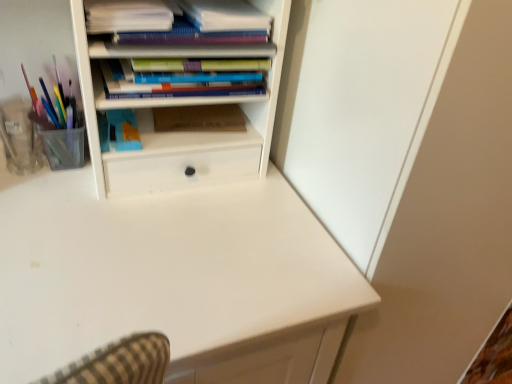
Where is `free space above brown cardboard at center, the 1th paperback book viewed from the right (from a real-world perspective)`? This screenshot has height=384, width=512. free space above brown cardboard at center, the 1th paperback book viewed from the right (from a real-world perspective) is located at coordinates (204, 114).